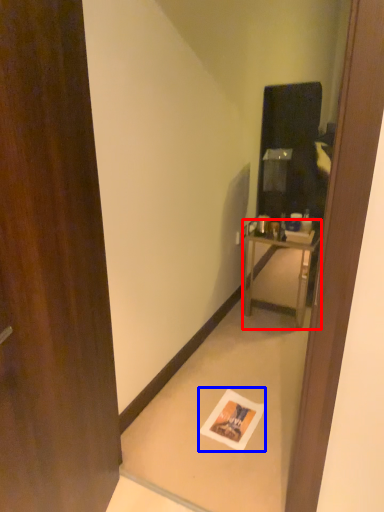
Question: Which point is closer to the camera, nightstand (highlighted by a red box) or postcard (highlighted by a blue box)?

Choices:
 (A) nightstand
 (B) postcard

Answer: (B)